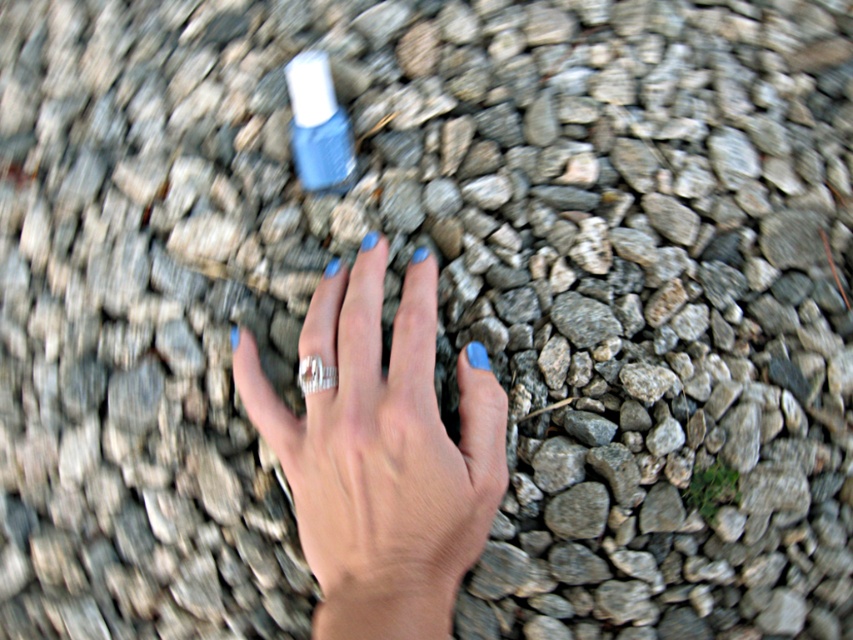
Question: Does blue glass nail polish at center appear under silver metallic ring at center?

Choices:
 (A) no
 (B) yes

Answer: (A)

Question: Which object is farther from the camera taking this photo?

Choices:
 (A) blue glass nail polish at center
 (B) blue matte nail polish at center
 (C) silver metallic ring at center

Answer: (A)

Question: Does blue matte nail polish at center appear on the left side of blue glass nail polish at center?

Choices:
 (A) yes
 (B) no

Answer: (B)

Question: Which point is farther from the camera taking this photo?

Choices:
 (A) (328, 369)
 (B) (408, 497)
 (C) (318, 64)

Answer: (C)

Question: Estimate the real-world distances between objects in this image. Which object is closer to the silver metallic ring at center?

Choices:
 (A) blue matte nail polish at center
 (B) blue glass nail polish at center

Answer: (A)

Question: Is blue matte nail polish at center closer to camera compared to silver metallic ring at center?

Choices:
 (A) yes
 (B) no

Answer: (A)